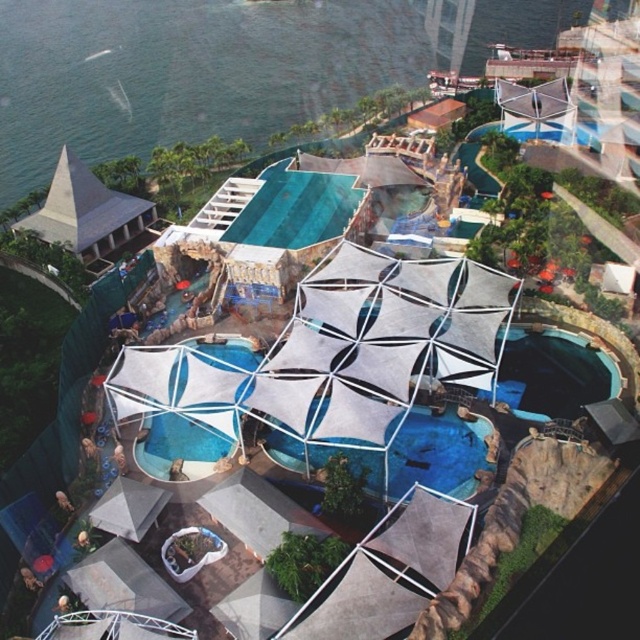
Question: Among these points, which one is farthest from the camera?

Choices:
 (A) (118, 365)
 (B) (333, 448)

Answer: (A)

Question: In this image, where is white fabric pool at center located relative to transparent plastic pool at center?

Choices:
 (A) above
 (B) below

Answer: (A)

Question: Which point appears closest to the camera in this image?

Choices:
 (A) (291, 401)
 (B) (106, 200)
 (C) (397, 464)

Answer: (A)

Question: Which of the following is the farthest from the observer?

Choices:
 (A) transparent plastic pool at center
 (B) matte gray pyramid at upper left

Answer: (B)

Question: From the image, what is the correct spatial relationship of transparent plastic pool at center in relation to matte gray pyramid at upper left?

Choices:
 (A) left
 (B) right

Answer: (B)

Question: Can you confirm if white fabric pool at center is positioned to the left of matte gray pyramid at upper left?

Choices:
 (A) no
 (B) yes

Answer: (A)